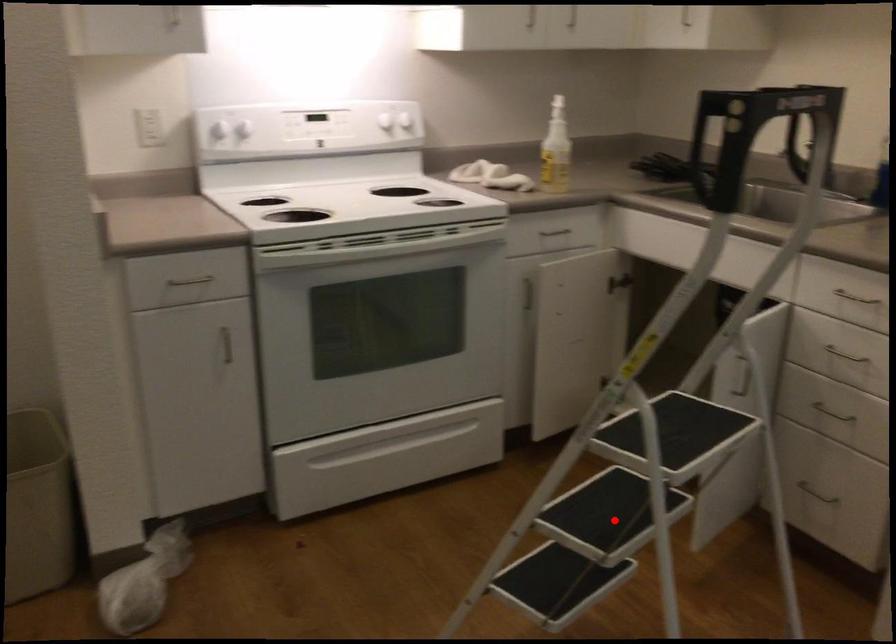
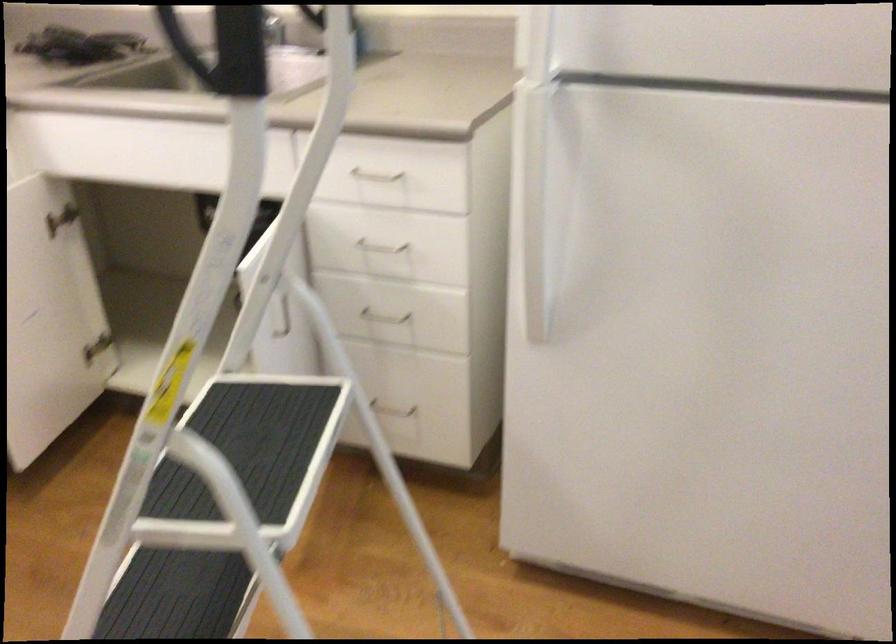
Find the pixel in the second image that matches the highlighted location in the first image.

(179, 596)